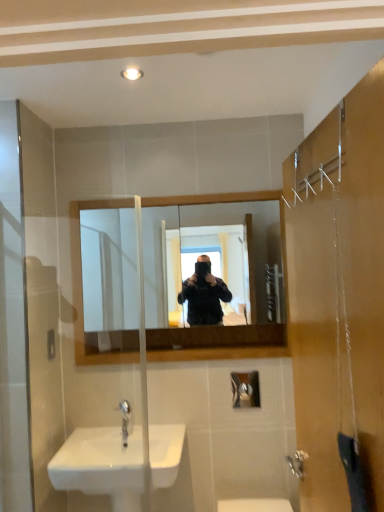
Question: Is white glossy light fixture at upper center smaller than silver metallic faucet at lower center?

Choices:
 (A) no
 (B) yes

Answer: (B)

Question: Could you tell me if white glossy light fixture at upper center is turned towards silver metallic faucet at lower center?

Choices:
 (A) no
 (B) yes

Answer: (A)

Question: Is white glossy light fixture at upper center behind silver metallic faucet at lower center?

Choices:
 (A) no
 (B) yes

Answer: (A)

Question: Is white glossy light fixture at upper center outside of silver metallic faucet at lower center?

Choices:
 (A) yes
 (B) no

Answer: (A)

Question: Is white glossy light fixture at upper center positioned in front of silver metallic faucet at lower center?

Choices:
 (A) yes
 (B) no

Answer: (A)

Question: Considering their positions, is wooden frame mirror at center located in front of or behind white glossy sink at lower left?

Choices:
 (A) behind
 (B) front

Answer: (A)

Question: Considering the positions of point coord(144,247) and point coord(115,492), is point coord(144,247) closer or farther from the camera than point coord(115,492)?

Choices:
 (A) closer
 (B) farther

Answer: (B)

Question: From a real-world perspective, is wooden frame mirror at center above or below white glossy sink at lower left?

Choices:
 (A) below
 (B) above

Answer: (B)

Question: Looking at their shapes, would you say wooden frame mirror at center is wider or thinner than white glossy sink at lower left?

Choices:
 (A) wide
 (B) thin

Answer: (B)

Question: Would you say silver metallic faucet at lower center is inside or outside white glossy sink at lower left?

Choices:
 (A) outside
 (B) inside

Answer: (A)

Question: From the image's perspective, is silver metallic faucet at lower center located above or below white glossy sink at lower left?

Choices:
 (A) below
 (B) above

Answer: (B)

Question: Based on their positions, is silver metallic faucet at lower center located to the left or right of white glossy sink at lower left?

Choices:
 (A) right
 (B) left

Answer: (B)

Question: Based on their sizes in the image, would you say silver metallic faucet at lower center is bigger or smaller than white glossy sink at lower left?

Choices:
 (A) small
 (B) big

Answer: (A)

Question: Is white glossy light fixture at upper center bigger or smaller than wooden frame mirror at center?

Choices:
 (A) big
 (B) small

Answer: (B)

Question: From their relative heights in the image, would you say white glossy light fixture at upper center is taller or shorter than wooden frame mirror at center?

Choices:
 (A) short
 (B) tall

Answer: (A)